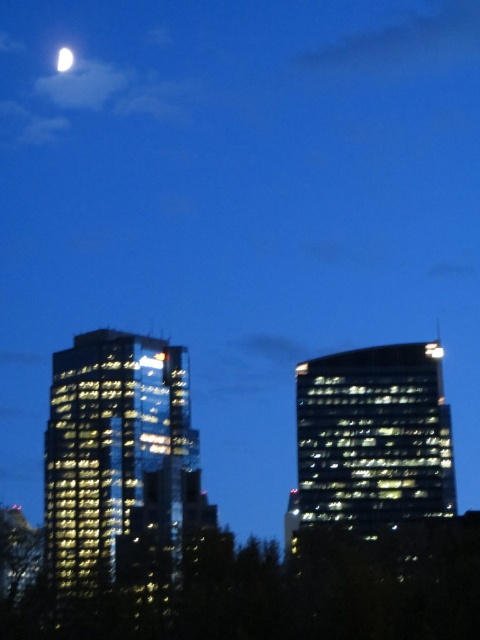
Does point (119, 509) come closer to viewer compared to point (61, 67)?

Yes, it is.

Locate an element on the screen. glossy glass building at left is located at coordinates (120, 467).

At what (x,y) coordinates should I click in order to perform the action: click on glossy glass building at left. Please return your answer as a coordinate pair (x, y). Looking at the image, I should click on (120, 467).

Is glossy glass building at left below glossy glass skyscraper at right?

Yes, glossy glass building at left is below glossy glass skyscraper at right.

Is point (127, 470) closer to viewer compared to point (372, 424)?

No, (127, 470) is behind (372, 424).

Does point (159, 429) come in front of point (303, 465)?

Yes.

The width and height of the screenshot is (480, 640). Identify the location of glossy glass building at left. (120, 467).

Who is higher up, glossy glass skyscraper at right or white glossy moon at upper left?

Positioned higher is white glossy moon at upper left.

Is glossy glass skyscraper at right to the right of white glossy moon at upper left from the viewer's perspective?

Indeed, glossy glass skyscraper at right is positioned on the right side of white glossy moon at upper left.

At what (x,y) coordinates should I click in order to perform the action: click on glossy glass skyscraper at right. Please return your answer as a coordinate pair (x, y). The image size is (480, 640). Looking at the image, I should click on (372, 440).

At what (x,y) coordinates should I click in order to perform the action: click on glossy glass skyscraper at right. Please return your answer as a coordinate pair (x, y). Looking at the image, I should click on pyautogui.click(x=372, y=440).